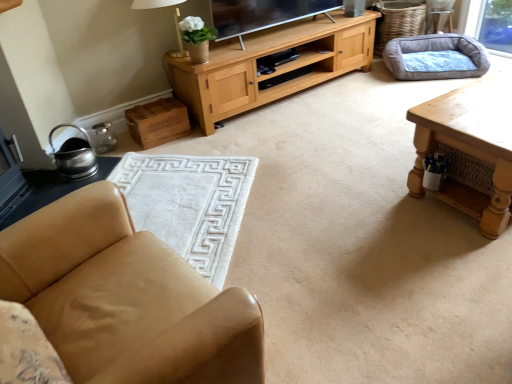
Where is `free space between wooden table at right and white soft rug at lower left`? The image size is (512, 384). free space between wooden table at right and white soft rug at lower left is located at coordinates (334, 211).